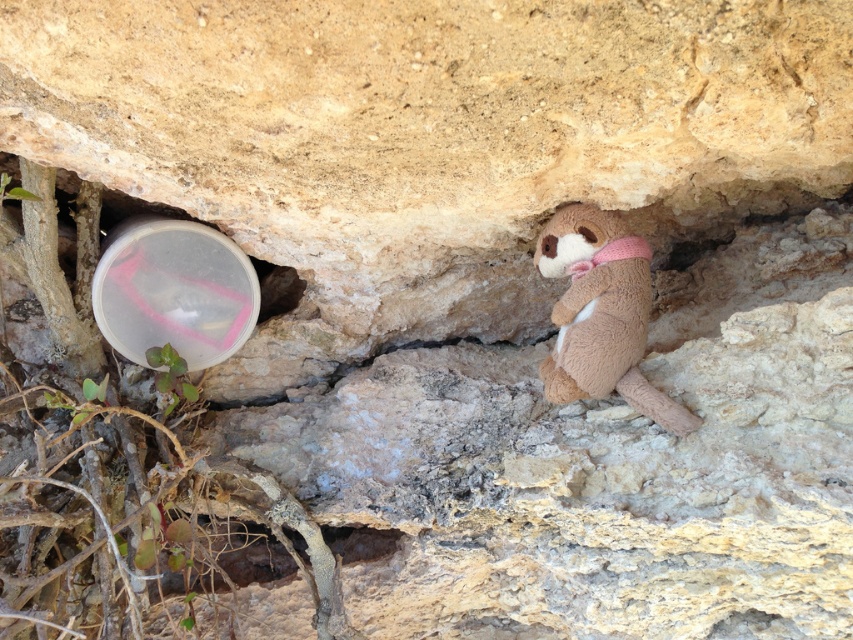
Question: Is transparent plastic bubble at lower left closer to the viewer compared to brown plush toy at center?

Choices:
 (A) yes
 (B) no

Answer: (B)

Question: Which object is the farthest from the smooth stone hole at center?

Choices:
 (A) transparent plastic bubble at lower left
 (B) brown plush toy at center

Answer: (B)

Question: Which object is farther from the camera taking this photo?

Choices:
 (A) smooth stone hole at center
 (B) brown plush toy at center
 (C) transparent plastic bubble at lower left

Answer: (A)

Question: Does transparent plastic bubble at lower left lie in front of smooth stone hole at center?

Choices:
 (A) no
 (B) yes

Answer: (B)

Question: Is transparent plastic bubble at lower left to the right of brown plush toy at center from the viewer's perspective?

Choices:
 (A) yes
 (B) no

Answer: (B)

Question: Which of the following is the farthest from the observer?

Choices:
 (A) (688, 422)
 (B) (354, 545)

Answer: (B)